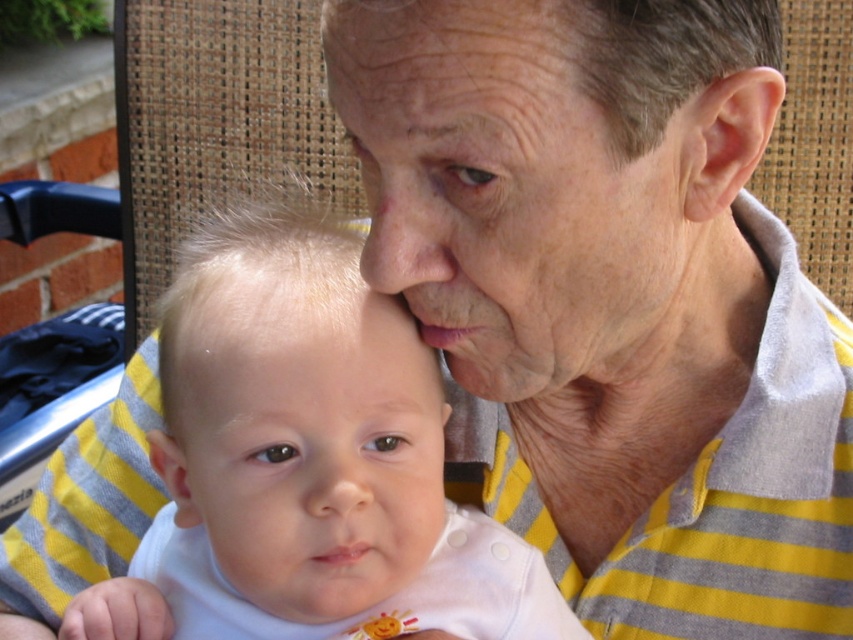
Is the position of white soft fabric baby at center less distant than that of smooth white baby at center?

Yes, white soft fabric baby at center is in front of smooth white baby at center.

Which of these two, white soft fabric baby at center or smooth white baby at center, stands taller?

Standing taller between the two is white soft fabric baby at center.

Between point (369, 321) and point (387, 337), which one is positioned behind?

The point (387, 337) is more distant.

The image size is (853, 640). What are the coordinates of `white soft fabric baby at center` in the screenshot? It's located at (306, 465).

Which is below, dry skin at center or smooth white baby at center?

smooth white baby at center is lower down.

Does dry skin at center have a greater width compared to smooth white baby at center?

Correct, the width of dry skin at center exceeds that of smooth white baby at center.

This screenshot has width=853, height=640. Describe the element at coordinates (508, 196) in the screenshot. I see `dry skin at center` at that location.

This screenshot has height=640, width=853. I want to click on dry skin at center, so click(x=508, y=196).

Measure the distance from white soft fabric baby at center to dry skin at center.

white soft fabric baby at center and dry skin at center are 3.98 inches apart from each other.

Can you confirm if white soft fabric baby at center is positioned above dry skin at center?

No.

Describe the element at coordinates (306, 465) in the screenshot. I see `white soft fabric baby at center` at that location.

This screenshot has height=640, width=853. Identify the location of white soft fabric baby at center. (306, 465).